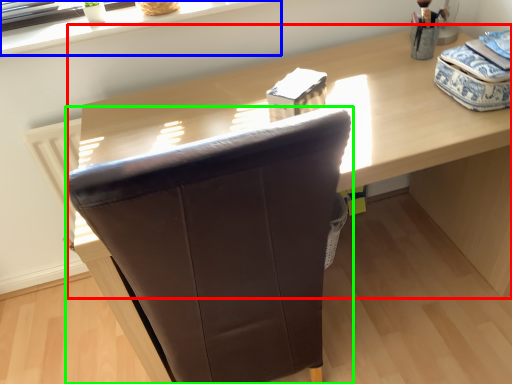
Question: Considering the real-world distances, which object is farthest from computer desk (highlighted by a red box)? window sill (highlighted by a blue box) or chair (highlighted by a green box)?

Choices:
 (A) window sill
 (B) chair

Answer: (B)